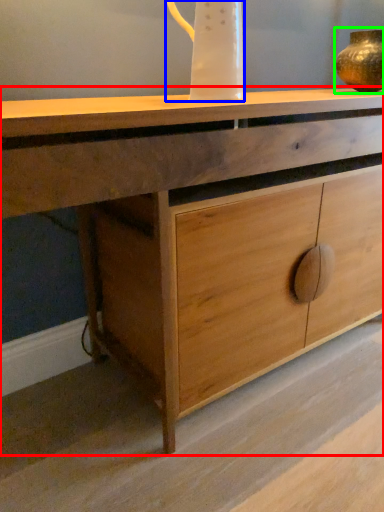
Question: Considering the real-world distances, which object is farthest from chest of drawers (highlighted by a red box)? jug (highlighted by a blue box) or candle holder (highlighted by a green box)?

Choices:
 (A) jug
 (B) candle holder

Answer: (B)